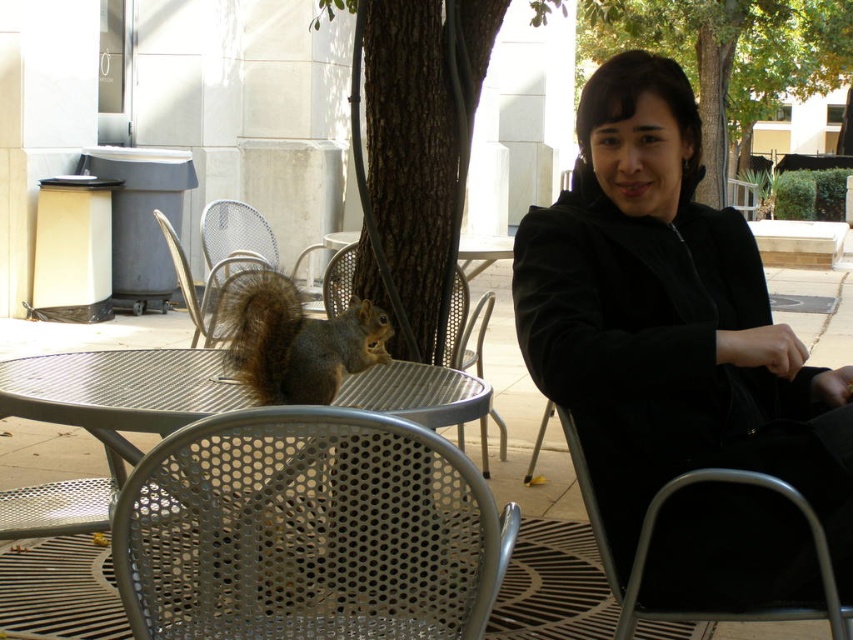
In the scene shown: Does metallic silver table at center appear under metallic silver chair at lower right?

Actually, metallic silver table at center is above metallic silver chair at lower right.

Which is in front, point (454, 385) or point (584, 474)?

Point (584, 474) is more forward.

The width and height of the screenshot is (853, 640). What are the coordinates of `metallic silver table at center` in the screenshot? It's located at (103, 420).

Does black matte jacket at center have a greater width compared to green leafy tree at center?

No, black matte jacket at center is not wider than green leafy tree at center.

Which is behind, point (782, 332) or point (711, 60)?

Point (711, 60)

The height and width of the screenshot is (640, 853). I want to click on black matte jacket at center, so click(x=669, y=321).

Image resolution: width=853 pixels, height=640 pixels. In order to click on black matte jacket at center in this screenshot , I will do `click(669, 321)`.

This screenshot has height=640, width=853. What do you see at coordinates (296, 340) in the screenshot?
I see `brown fur squirrel at center` at bounding box center [296, 340].

This screenshot has height=640, width=853. What do you see at coordinates (296, 340) in the screenshot?
I see `brown fur squirrel at center` at bounding box center [296, 340].

Locate an element on the screen. The image size is (853, 640). brown fur squirrel at center is located at coordinates (296, 340).